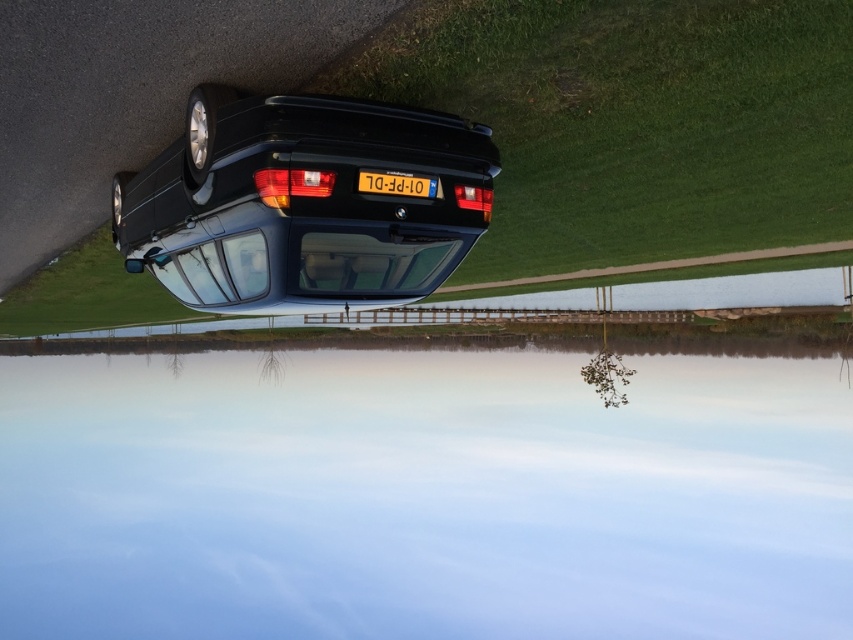
You are a photographer trying to capture the reflection of the car in the water. You need to know if the transparent glass water at center can fully reflect the matte plastic tail light at center. Can it?

The transparent glass water at center might be wider than matte plastic tail light at center, so it is possible that the reflection can fully capture the tail light if the water surface is wide enough to encompass it.

You are a photographer trying to capture the reflection of the black BMW car in the water. You notice the transparent glass water at center and the matte plastic tail light at center. Which object should you focus on first if you want to ensure the reflection of the car is fully visible?

The transparent glass water at center should be focused on first because it is positioned on the left side of the matte plastic tail light at center, which is where the car reflection is likely to be captured.